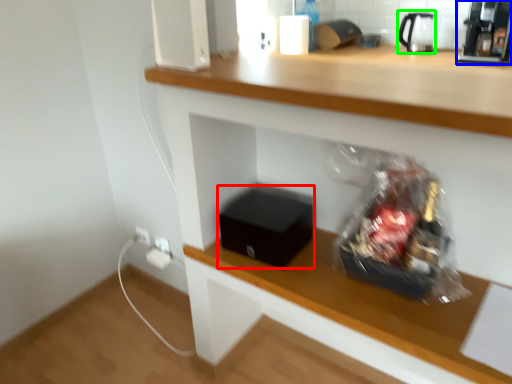
Question: Considering the real-world distances, which object is closest to box (highlighted by a red box)? coffee machine (highlighted by a blue box) or tea pot (highlighted by a green box).

Choices:
 (A) coffee machine
 (B) tea pot

Answer: (A)